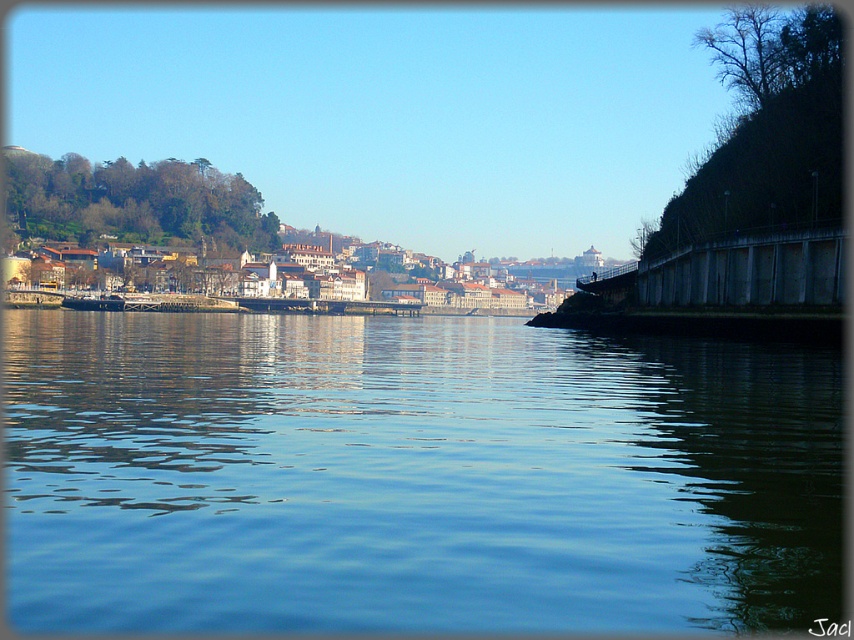
Which of these two, blue liquid water at center or shiny black boat at center, stands shorter?

With less height is shiny black boat at center.

Does blue liquid water at center lie in front of shiny black boat at center?

That is True.

Does point (697, 412) come behind point (114, 308)?

No, it is not.

What are the coordinates of `blue liquid water at center` in the screenshot? It's located at (412, 476).